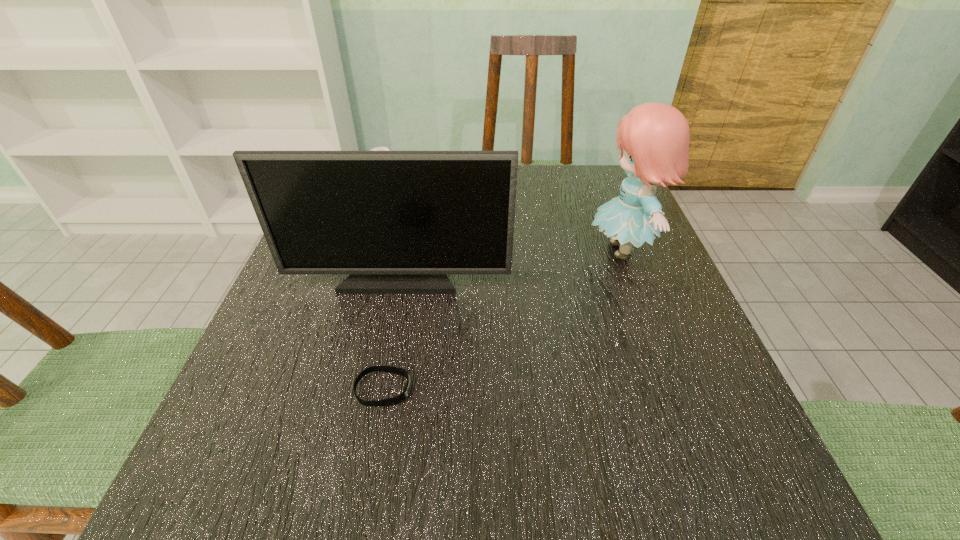
Identify the location of the rightmost object. The width and height of the screenshot is (960, 540). (653, 138).

This screenshot has width=960, height=540. Identify the location of monitor. (397, 221).

Image resolution: width=960 pixels, height=540 pixels. In order to click on the second shortest object in this screenshot , I will do `click(376, 148)`.

This screenshot has width=960, height=540. What are the coordinates of `beer can` in the screenshot? It's located at (376, 148).

At what (x,y) coordinates should I click in order to perform the action: click on the shortest object. Please return your answer as a coordinate pair (x, y). Image resolution: width=960 pixels, height=540 pixels. Looking at the image, I should click on (400, 398).

Find the location of `the nearest object`. the nearest object is located at coordinates (400, 398).

Locate an element on the screen. vacant area located 0.140m on the front-facing side of the doll is located at coordinates tap(518, 249).

Identify the location of vacant space positioned 0.120m on the front-facing side of the doll. The width and height of the screenshot is (960, 540). (528, 249).

The image size is (960, 540). Identify the location of free location located on the front-facing side of the doll. (454, 249).

Locate an element on the screen. The width and height of the screenshot is (960, 540). vacant space located on the screen side of the monitor is located at coordinates (391, 318).